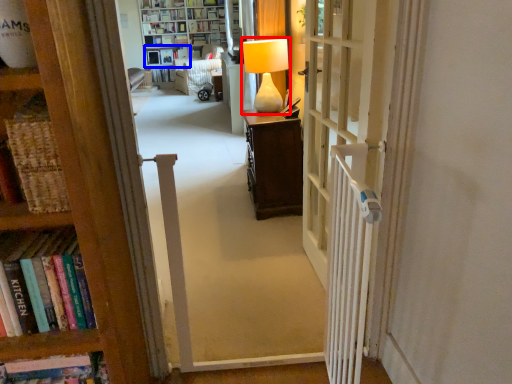
Question: Among these objects, which one is farthest to the camera, table lamp (highlighted by a red box) or shelf (highlighted by a blue box)?

Choices:
 (A) table lamp
 (B) shelf

Answer: (B)